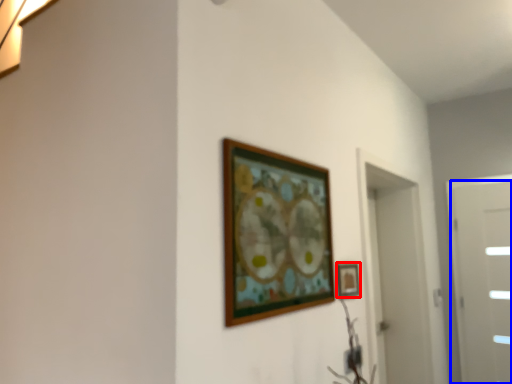
Question: Which object appears farthest to the camera in this image, picture frame (highlighted by a red box) or door (highlighted by a blue box)?

Choices:
 (A) picture frame
 (B) door

Answer: (B)